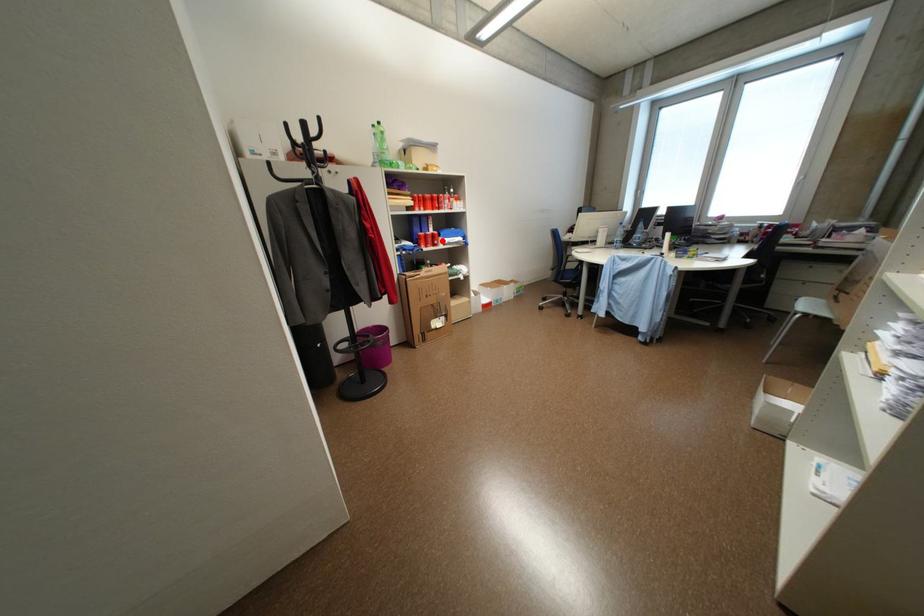
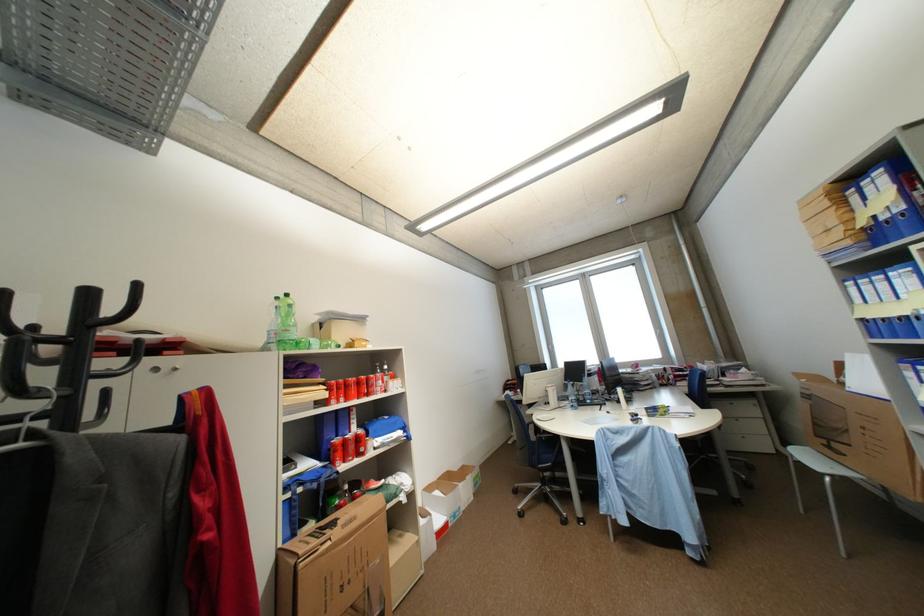
Question: A red point is marked in image1. In image2, is the corresponding 3D point closer to the camera or farther? Reply with the corresponding letter.

Choices:
 (A) The corresponding 3D point is closer.
 (B) The corresponding 3D point is farther.

Answer: (B)